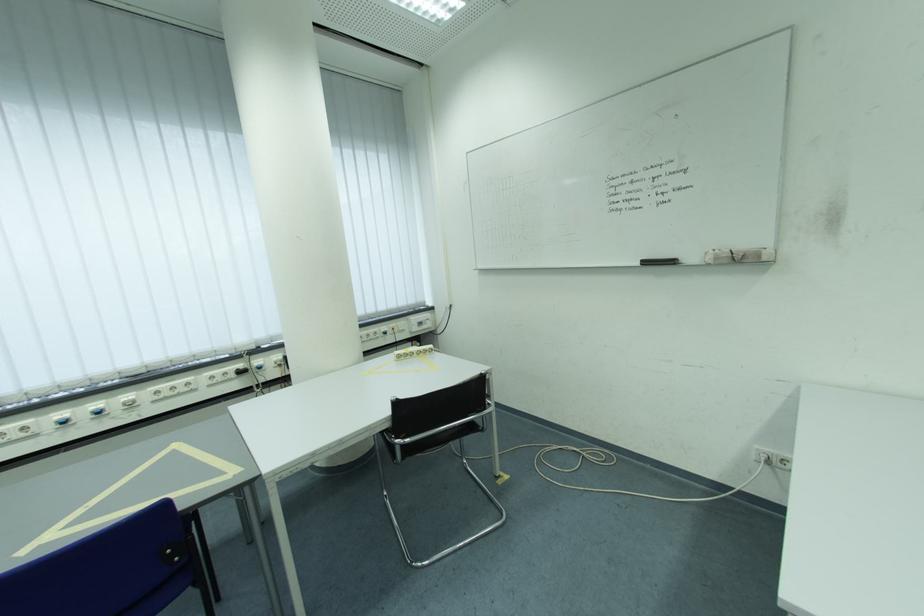
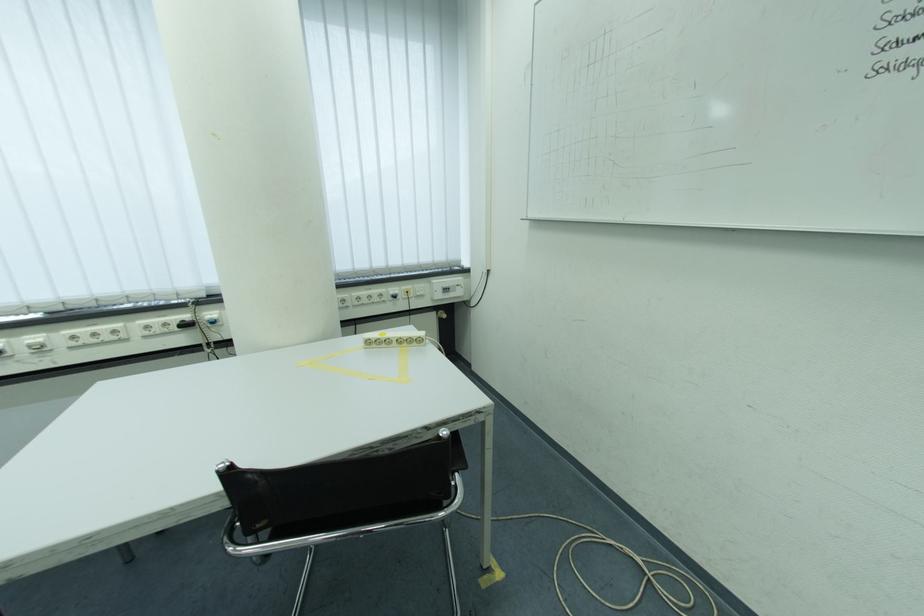
Where in the second image is the point corresponding to point 592,459 from the first image?

(659, 582)